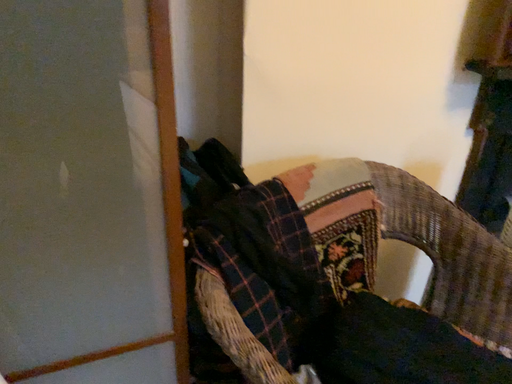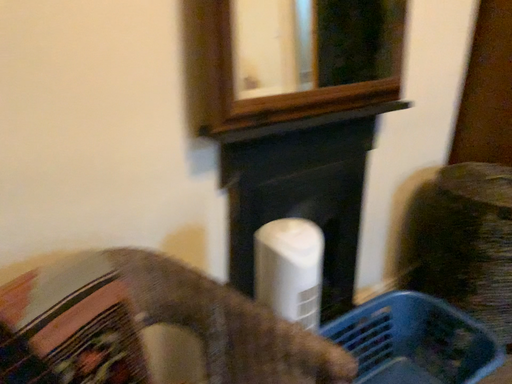
Question: How did the camera likely rotate when shooting the video?

Choices:
 (A) rotated downward
 (B) rotated upward

Answer: (B)